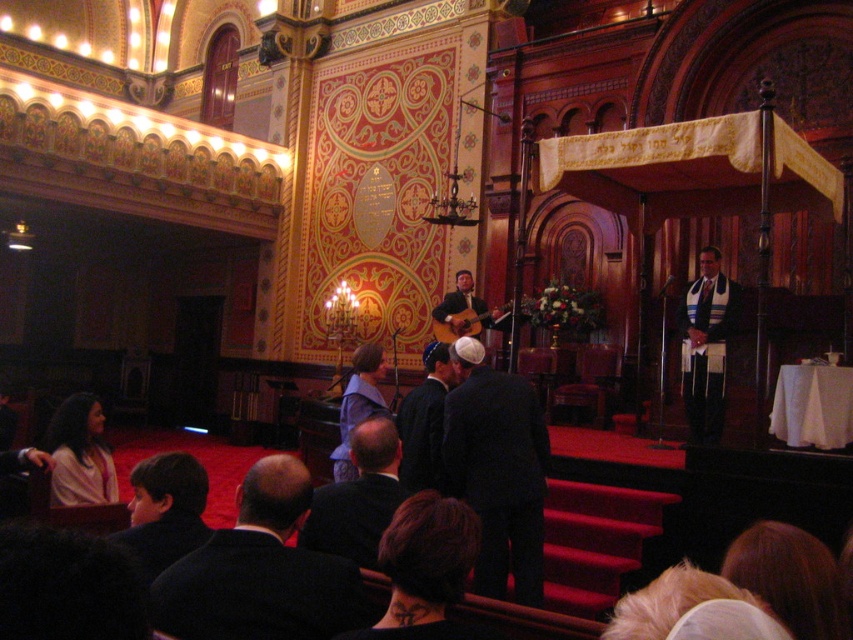
In the scene shown: Does black suit at lower left appear over matte brown guitar at center?

No, black suit at lower left is not above matte brown guitar at center.

Who is positioned more to the left, black suit at lower left or matte brown guitar at center?

Positioned to the left is black suit at lower left.

Is point (219, 602) less distant than point (448, 324)?

Yes, it is in front of point (448, 324).

This screenshot has width=853, height=640. Identify the location of black suit at lower left. (260, 570).

Locate an element on the screen. Image resolution: width=853 pixels, height=640 pixels. white textured kippah at center is located at coordinates (706, 346).

Between point (699, 371) and point (403, 460), which one is positioned behind?

The point (699, 371) is behind.

The image size is (853, 640). Find the location of `white textured kippah at center`. white textured kippah at center is located at coordinates (706, 346).

From the picture: Can you confirm if black suit at lower left is positioned to the left of black matte suit at center?

Yes, black suit at lower left is to the left of black matte suit at center.

Is point (338, 582) closer to camera compared to point (527, 513)?

That is True.

Which is behind, point (270, 600) or point (480, 560)?

Positioned behind is point (480, 560).

Where is `black suit at lower left`? black suit at lower left is located at coordinates (260, 570).